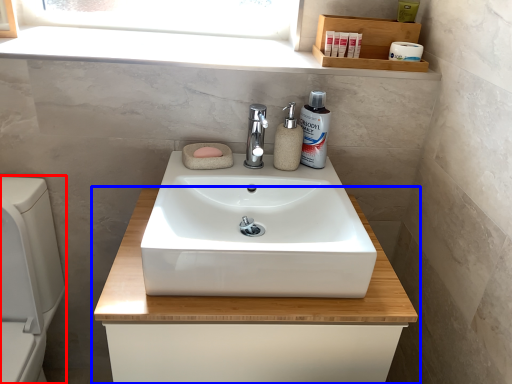
Question: Which of the following is the closest to the observer, appliance (highlighted by a red box) or bathroom cabinet (highlighted by a blue box)?

Choices:
 (A) appliance
 (B) bathroom cabinet

Answer: (A)